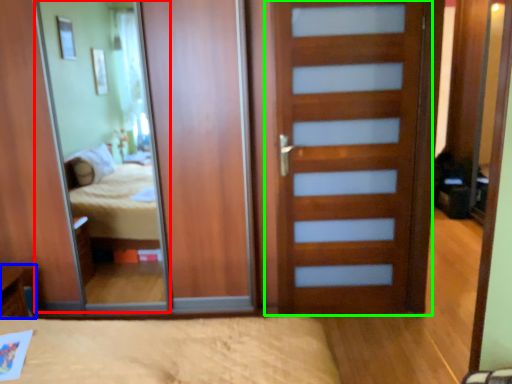
Question: Which object is the farthest from mirror (highlighted by a red box)? Choose among these: table (highlighted by a blue box) or door (highlighted by a green box).

Choices:
 (A) table
 (B) door

Answer: (B)